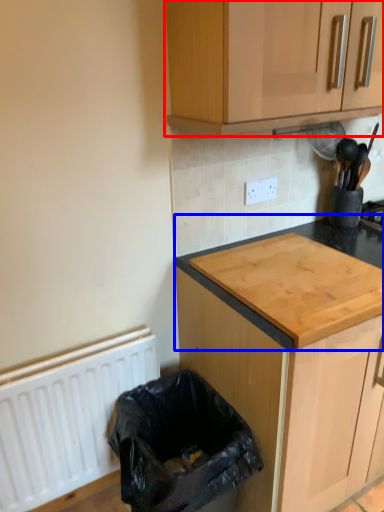
Question: Among these objects, which one is nearest to the camera, cabinetry (highlighted by a red box) or countertop (highlighted by a blue box)?

Choices:
 (A) cabinetry
 (B) countertop

Answer: (A)